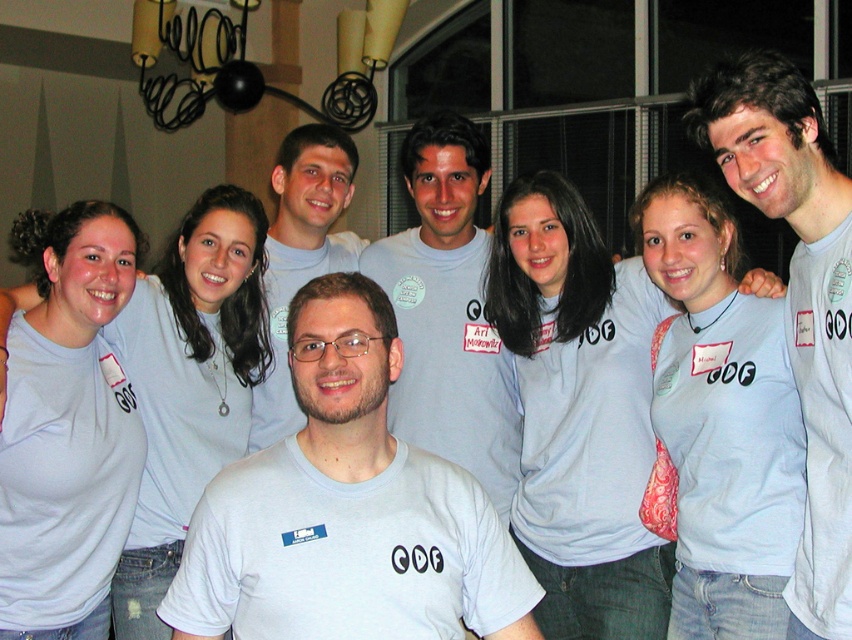
Question: Can you confirm if gray matte t-shirt at center is positioned below light blue cotton shirt at upper left?

Choices:
 (A) no
 (B) yes

Answer: (B)

Question: Is gray matte t-shirt at center below gray t-shirt at center?

Choices:
 (A) no
 (B) yes

Answer: (B)

Question: Which point appears farthest from the camera in this image?

Choices:
 (A) (501, 408)
 (B) (265, 385)
 (C) (593, 540)
 (D) (375, 394)

Answer: (A)

Question: Considering the real-world distances, which object is farthest from the light blue cotton shirt at upper left?

Choices:
 (A) gray matte t-shirt at center
 (B) gray t-shirt at center
 (C) light blue t-shirt at center
 (D) matte gray t-shirt at center

Answer: (B)

Question: Which object is farther from the camera taking this photo?

Choices:
 (A) gray t-shirt at center
 (B) gray matte t-shirt at center
 (C) light blue cotton shirt at center
 (D) matte gray t-shirt at center

Answer: (D)

Question: Is gray t-shirt at center positioned at the back of light blue cotton shirt at upper left?

Choices:
 (A) no
 (B) yes

Answer: (A)